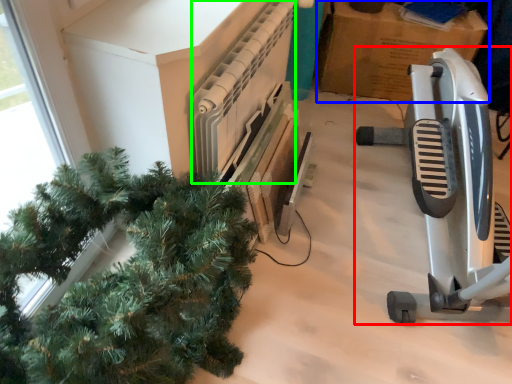
Question: Which object is the closest to the job (highlighted by a red box)? Choose among these: cardboard box (highlighted by a blue box) or radiator (highlighted by a green box).

Choices:
 (A) cardboard box
 (B) radiator

Answer: (B)